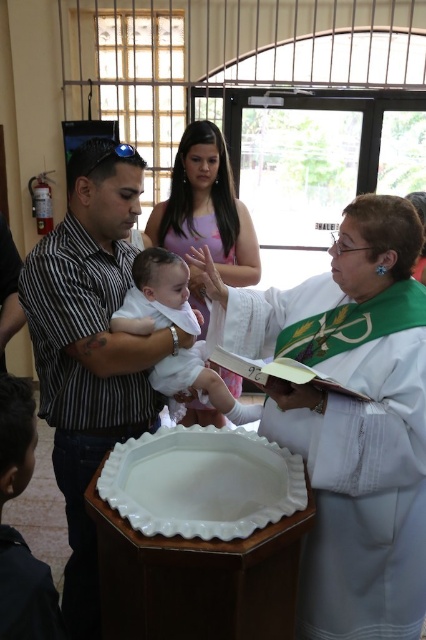
Question: Is white cloth at center bigger than white satin robe at center?

Choices:
 (A) no
 (B) yes

Answer: (B)

Question: Which object appears farthest from the camera in this image?

Choices:
 (A) matte pink dress at center
 (B) dark blue fabric at lower left

Answer: (A)

Question: Which object appears closest to the camera in this image?

Choices:
 (A) dark blue fabric at lower left
 (B) white cloth at center
 (C) striped shirt at left
 (D) white glossy tray at center

Answer: (A)

Question: Is white cloth at center positioned in front of striped shirt at left?

Choices:
 (A) no
 (B) yes

Answer: (B)

Question: From the image, what is the correct spatial relationship of white cloth at center in relation to dark blue fabric at lower left?

Choices:
 (A) left
 (B) right

Answer: (B)

Question: Which point is farther to the camera?

Choices:
 (A) dark blue fabric at lower left
 (B) white satin robe at center
 (C) matte pink dress at center

Answer: (B)